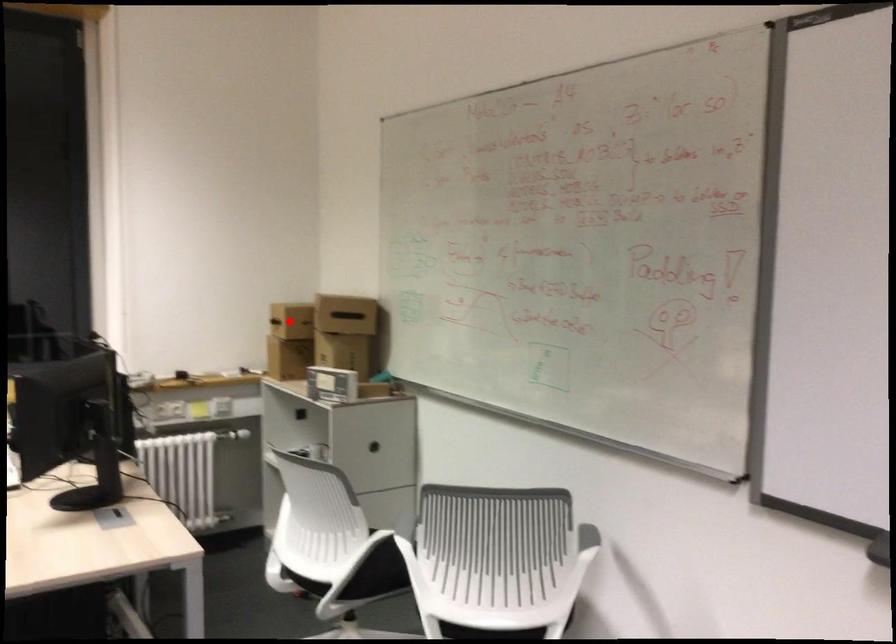
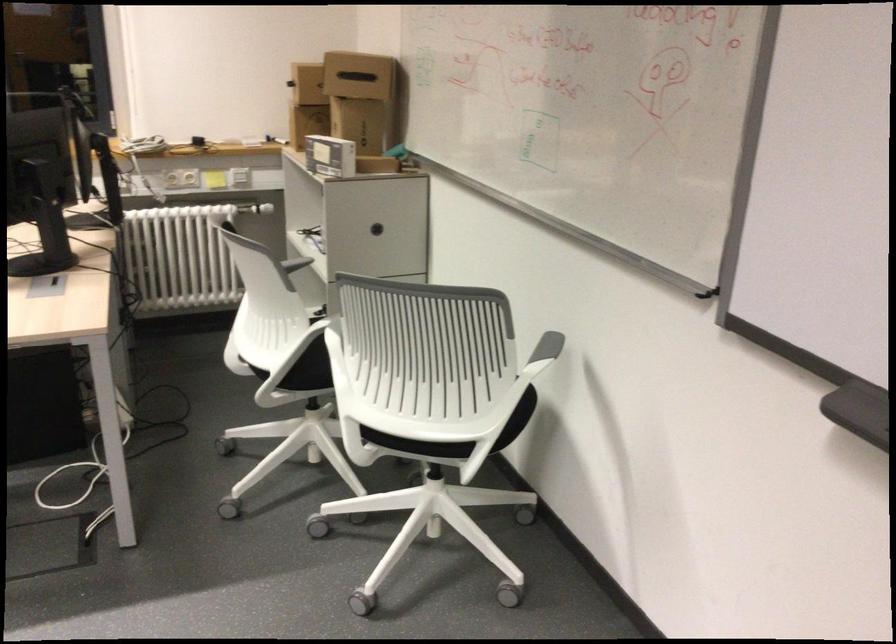
In the second image, find the point that corresponds to the highlighted location in the first image.

(307, 84)